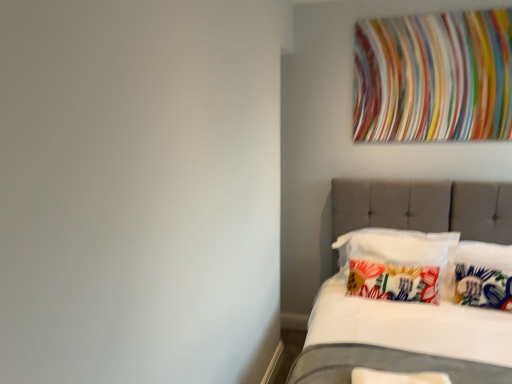
You are a GUI agent. You are given a task and a screenshot of the screen. Output one action in this format:
    pyautogui.click(x=<x>, y=<y>)
    Task: Click on the white soft pillow at lower right, the 4th pillow in the back-to-front sequence
    
    Given the screenshot: What is the action you would take?
    pyautogui.click(x=397, y=377)

What do you see at coordinates (393, 282) in the screenshot? The height and width of the screenshot is (384, 512). I see `floral fabric pillow at center, arranged as the third pillow when viewed from the front` at bounding box center [393, 282].

You are a GUI agent. You are given a task and a screenshot of the screen. Output one action in this format:
    pyautogui.click(x=<x>, y=<y>)
    Task: Click on the white soft pillow at lower right, marked as the first pillow in a front-to-back arrangement
    
    Given the screenshot: What is the action you would take?
    pyautogui.click(x=397, y=377)

Does tufted fabric bed at right have a greater width compared to multicolored fabric at upper right?

Indeed, tufted fabric bed at right has a greater width compared to multicolored fabric at upper right.

Is the position of tufted fabric bed at right more distant than that of multicolored fabric at upper right?

That is False.

Which object is positioned more to the left, tufted fabric bed at right or multicolored fabric at upper right?

From the viewer's perspective, tufted fabric bed at right appears more on the left side.

Is tufted fabric bed at right taller than multicolored fabric at upper right?

Correct, tufted fabric bed at right is much taller as multicolored fabric at upper right.

Measure the distance from floral fabric pillow at right, the 2th pillow in the front-to-back sequence, to multicolored fabric at upper right.

They are 1.06 meters apart.

Looking at the image, does floral fabric pillow at right, the 2th pillow in the front-to-back sequence, seem bigger or smaller compared to multicolored fabric at upper right?

Clearly, floral fabric pillow at right, the 2th pillow in the front-to-back sequence, is smaller in size than multicolored fabric at upper right.

In the scene shown: Between floral fabric pillow at right, acting as the 3th pillow starting from the back, and multicolored fabric at upper right, which one appears on the right side from the viewer's perspective?

From the viewer's perspective, floral fabric pillow at right, acting as the 3th pillow starting from the back, appears more on the right side.

Is floral fabric pillow at right, the 2th pillow in the front-to-back sequence, not near multicolored fabric at upper right?

floral fabric pillow at right, the 2th pillow in the front-to-back sequence, is positioned a significant distance from multicolored fabric at upper right.

Based on the photo, in terms of width, does multicolored fabric at upper right look wider or thinner when compared to floral fabric pillow at right, the 2th pillow in the front-to-back sequence?

Considering their sizes, multicolored fabric at upper right looks slimmer than floral fabric pillow at right, the 2th pillow in the front-to-back sequence.

Consider the image. Are multicolored fabric at upper right and floral fabric pillow at right, the 2th pillow in the front-to-back sequence, making contact?

No, multicolored fabric at upper right is not in contact with floral fabric pillow at right, the 2th pillow in the front-to-back sequence.

Considering the relative positions of multicolored fabric at upper right and floral fabric pillow at right, the 2th pillow in the front-to-back sequence, in the image provided, is multicolored fabric at upper right to the left of floral fabric pillow at right, the 2th pillow in the front-to-back sequence, from the viewer's perspective?

Correct, you'll find multicolored fabric at upper right to the left of floral fabric pillow at right, the 2th pillow in the front-to-back sequence.

There is a multicolored fabric at upper right. Identify the location of the 3rd pillow below it (from a real-world perspective). The width and height of the screenshot is (512, 384). (483, 275).

Which object is further away from the camera, white soft pillow at lower right, marked as the first pillow in a front-to-back arrangement, or multicolored fabric at upper right?

multicolored fabric at upper right is further from the camera.

Considering the relative positions of white soft pillow at lower right, the 4th pillow in the back-to-front sequence, and multicolored fabric at upper right in the image provided, is white soft pillow at lower right, the 4th pillow in the back-to-front sequence, to the left of multicolored fabric at upper right from the viewer's perspective?

Indeed, white soft pillow at lower right, the 4th pillow in the back-to-front sequence, is positioned on the left side of multicolored fabric at upper right.

Is white soft pillow at lower right, marked as the first pillow in a front-to-back arrangement, shorter than multicolored fabric at upper right?

Yes, white soft pillow at lower right, marked as the first pillow in a front-to-back arrangement, is shorter than multicolored fabric at upper right.

Can you confirm if multicolored fabric at upper right is bigger than white soft pillow at lower right, the 4th pillow in the back-to-front sequence?

Correct, multicolored fabric at upper right is larger in size than white soft pillow at lower right, the 4th pillow in the back-to-front sequence.

Based on the photo, could you tell me if multicolored fabric at upper right is turned towards white soft pillow at lower right, the 4th pillow in the back-to-front sequence?

No, multicolored fabric at upper right is not turned towards white soft pillow at lower right, the 4th pillow in the back-to-front sequence.

You are a GUI agent. You are given a task and a screenshot of the screen. Output one action in this format:
    pyautogui.click(x=<x>, y=<y>)
    Task: Click on the tapestry that appears on the right of white soft pillow at lower right, the 4th pillow in the back-to-front sequence
    The image size is (512, 384).
    Given the screenshot: What is the action you would take?
    pyautogui.click(x=433, y=77)

From a real-world perspective, which is physically below, multicolored fabric at upper right or white soft pillow at lower right, marked as the first pillow in a front-to-back arrangement?

From a 3D spatial view, white soft pillow at lower right, marked as the first pillow in a front-to-back arrangement, is below.

Is floral fabric pillow at center, which is counted as the second pillow, starting from the back, oriented away from white soft pillow at lower right, the 4th pillow in the back-to-front sequence?

No, white soft pillow at lower right, the 4th pillow in the back-to-front sequence, is not at the back of floral fabric pillow at center, which is counted as the second pillow, starting from the back.

From a real-world perspective, is floral fabric pillow at center, which is counted as the second pillow, starting from the back, positioned under white soft pillow at lower right, the 4th pillow in the back-to-front sequence, based on gravity?

Actually, floral fabric pillow at center, which is counted as the second pillow, starting from the back, is physically above white soft pillow at lower right, the 4th pillow in the back-to-front sequence, in the real world.

Consider the image. Is floral fabric pillow at right, acting as the 3th pillow starting from the back, bigger or smaller than white soft pillow at lower right, marked as the first pillow in a front-to-back arrangement?

floral fabric pillow at right, acting as the 3th pillow starting from the back, is bigger than white soft pillow at lower right, marked as the first pillow in a front-to-back arrangement.

From the image's perspective, is floral fabric pillow at right, the 2th pillow in the front-to-back sequence, located beneath white soft pillow at lower right, marked as the first pillow in a front-to-back arrangement?

No, from the image's perspective, floral fabric pillow at right, the 2th pillow in the front-to-back sequence, is not below white soft pillow at lower right, marked as the first pillow in a front-to-back arrangement.

Relative to white soft pillow at lower right, the 4th pillow in the back-to-front sequence, is floral fabric pillow at right, the 2th pillow in the front-to-back sequence, in front or behind?

Clearly, floral fabric pillow at right, the 2th pillow in the front-to-back sequence, is behind white soft pillow at lower right, the 4th pillow in the back-to-front sequence.

Measure the distance from floral fabric pillow at right, the 2th pillow in the front-to-back sequence, to white soft pillow at lower right, the 4th pillow in the back-to-front sequence.

They are 1.07 meters apart.

In order to click on tapestry above the tufted fabric bed at right (from a real-world perspective) in this screenshot , I will do `click(433, 77)`.

Where is `pillow that is the 3rd object directly below the multicolored fabric at upper right (from a real-world perspective)`? The width and height of the screenshot is (512, 384). pillow that is the 3rd object directly below the multicolored fabric at upper right (from a real-world perspective) is located at coordinates (483, 275).

Which object lies nearer to the anchor point floral fabric pillow at right, acting as the 3th pillow starting from the back, multicolored fabric at upper right or white soft pillow at lower right, marked as the first pillow in a front-to-back arrangement?

multicolored fabric at upper right is positioned closer to the anchor floral fabric pillow at right, acting as the 3th pillow starting from the back.

Estimate the real-world distances between objects in this image. Which object is further from floral fabric pillow at center, which is counted as the second pillow, starting from the back, white soft pillow at lower right, the 4th pillow in the back-to-front sequence, or printed fabric pillow at center, positioned as the first pillow in back-to-front order?

Among the two, white soft pillow at lower right, the 4th pillow in the back-to-front sequence, is located further to floral fabric pillow at center, which is counted as the second pillow, starting from the back.

Based on their spatial positions, is multicolored fabric at upper right or printed fabric pillow at center, positioned as the first pillow in back-to-front order, further from white soft pillow at lower right, marked as the first pillow in a front-to-back arrangement?

Based on the image, multicolored fabric at upper right appears to be further to white soft pillow at lower right, marked as the first pillow in a front-to-back arrangement.

When comparing their distances from printed fabric pillow at center, positioned as the 4th pillow in front-to-back order, does floral fabric pillow at right, the 2th pillow in the front-to-back sequence, or multicolored fabric at upper right seem further?

multicolored fabric at upper right is further to printed fabric pillow at center, positioned as the 4th pillow in front-to-back order.

Which object lies nearer to the anchor point white soft pillow at lower right, marked as the first pillow in a front-to-back arrangement, printed fabric pillow at center, positioned as the first pillow in back-to-front order, or floral fabric pillow at right, the 2th pillow in the front-to-back sequence?

printed fabric pillow at center, positioned as the first pillow in back-to-front order, is closer to white soft pillow at lower right, marked as the first pillow in a front-to-back arrangement.

When comparing their distances from tufted fabric bed at right, does printed fabric pillow at center, positioned as the 4th pillow in front-to-back order, or floral fabric pillow at center, arranged as the third pillow when viewed from the front, seem closer?

printed fabric pillow at center, positioned as the 4th pillow in front-to-back order, is closer to tufted fabric bed at right.

Based on their spatial positions, is multicolored fabric at upper right or floral fabric pillow at right, acting as the 3th pillow starting from the back, further from printed fabric pillow at center, positioned as the first pillow in back-to-front order?

Among the two, multicolored fabric at upper right is located further to printed fabric pillow at center, positioned as the first pillow in back-to-front order.

Based on their spatial positions, is floral fabric pillow at right, the 2th pillow in the front-to-back sequence, or printed fabric pillow at center, positioned as the 4th pillow in front-to-back order, further from tufted fabric bed at right?

The object further to tufted fabric bed at right is floral fabric pillow at right, the 2th pillow in the front-to-back sequence.

Where is `pillow between multicolored fabric at upper right and floral fabric pillow at center, which is counted as the second pillow, starting from the back, in the vertical direction`? pillow between multicolored fabric at upper right and floral fabric pillow at center, which is counted as the second pillow, starting from the back, in the vertical direction is located at coordinates (398, 264).

Image resolution: width=512 pixels, height=384 pixels. I want to click on pillow between floral fabric pillow at center, arranged as the third pillow when viewed from the front, and floral fabric pillow at right, the 2th pillow in the front-to-back sequence, in the horizontal direction, so click(x=398, y=264).

The height and width of the screenshot is (384, 512). In order to click on pillow located between tufted fabric bed at right and floral fabric pillow at right, acting as the 3th pillow starting from the back, in the depth direction in this screenshot , I will do click(x=397, y=377).

Where is `tapestry located between tufted fabric bed at right and printed fabric pillow at center, positioned as the first pillow in back-to-front order, in the depth direction`? The width and height of the screenshot is (512, 384). tapestry located between tufted fabric bed at right and printed fabric pillow at center, positioned as the first pillow in back-to-front order, in the depth direction is located at coordinates (433, 77).